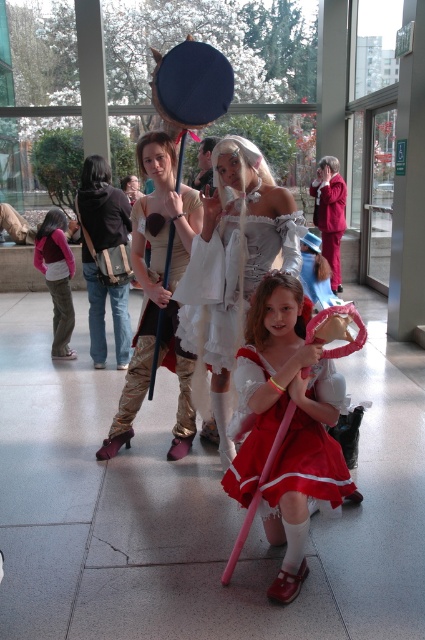
Between matte red dress at center and matte pink sweater at left, which one has more height?

matte pink sweater at left

Is matte red dress at center above matte pink sweater at left?

No, matte red dress at center is not above matte pink sweater at left.

Which is behind, point (306, 394) or point (65, 216)?

The point (65, 216) is more distant.

Locate an element on the screen. The height and width of the screenshot is (640, 425). matte red dress at center is located at coordinates (289, 422).

Is matte gold armor at center above matte pink sweater at left?

No, matte gold armor at center is not above matte pink sweater at left.

Is matte gold armor at center smaller than matte pink sweater at left?

Incorrect, matte gold armor at center is not smaller in size than matte pink sweater at left.

Does point (155, 150) come farther from viewer compared to point (47, 260)?

No, it is not.

Identify the location of matte gold armor at center. The image size is (425, 640). (158, 292).

Between white satin dress at center and velvet red cape at center, which one has less height?

white satin dress at center

Is white satin dress at center to the right of velvet red cape at center from the viewer's perspective?

Incorrect, white satin dress at center is not on the right side of velvet red cape at center.

The image size is (425, 640). What do you see at coordinates (212, 294) in the screenshot?
I see `white satin dress at center` at bounding box center [212, 294].

Locate an element on the screen. This screenshot has height=640, width=425. white satin dress at center is located at coordinates 212,294.